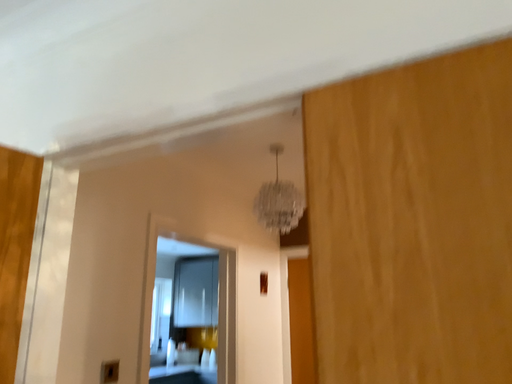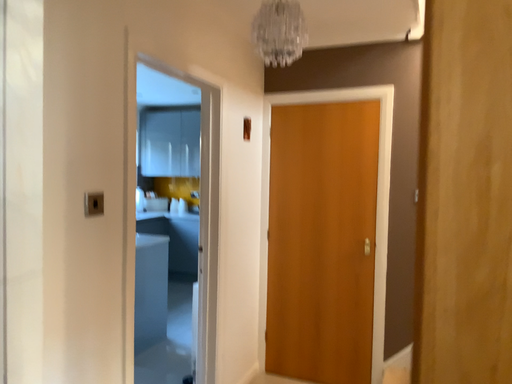
Question: How did the camera likely rotate when shooting the video?

Choices:
 (A) rotated upward
 (B) rotated downward

Answer: (B)